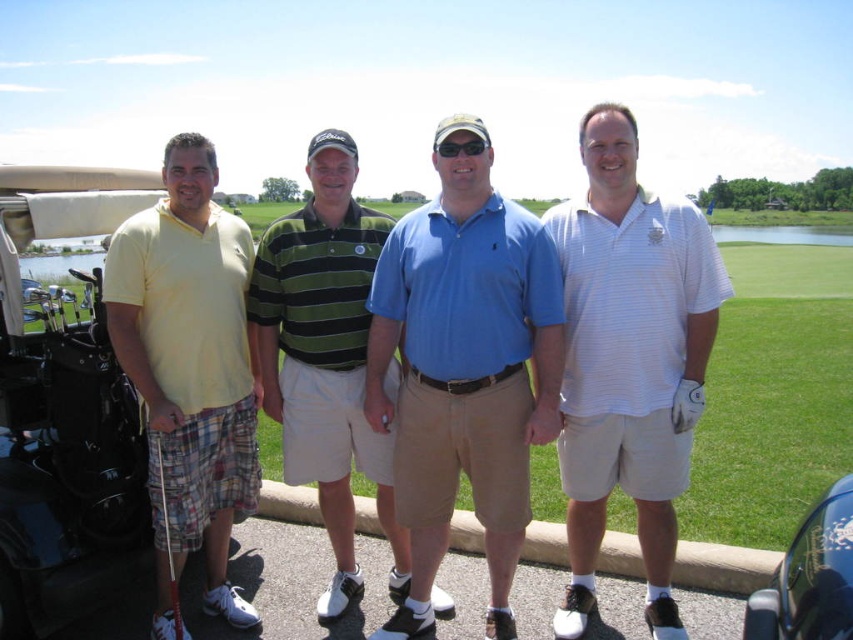
You are standing at the center of the golf course and see the point marked at coordinates [64,413]. What is located at that point?

The point at coordinates [64,413] indicates green grass at center.

You are standing at the point labeled point (506, 524) and want to walk to the golf cart located on the left side of the frame. Is the point labeled point (762, 365) behind you or in front of you as you face the golf cart?

The point labeled point (762, 365) is behind you relative to your current position at point (506, 524) when facing the golf cart on the left side of the frame.

From the picture: You are standing at the edge of the golf course and want to place a 3.5 meter long banner on the ground between yourself and the green grass at center. Can the banner fit entirely within that space?

The distance between you and the green grass at center is 3.66 meters, so a 3.5 meter long banner can fit entirely within that space since it is shorter than the available distance.